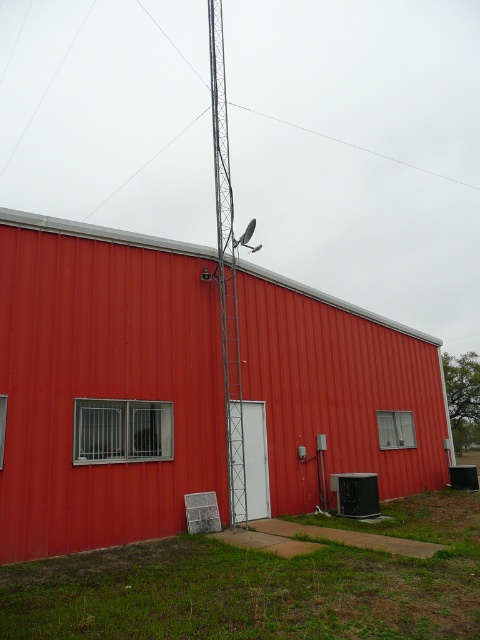
You are standing at point A, which is at coordinate point A at [7,435]. You need to reach point B, which is 24.95 feet away from you. The path to point B is blocked by the tall metallic tower. Can you go around the tower to reach point B without getting closer than 10 feet to it?

The distance between point A at [7,435] and point B is 24.95 feet. Since the path is blocked by the tower and you need to stay at least 10 feet away from it, you can go around the tower while maintaining the required distance. However, the exact feasibility depends on the tower dimensions not provided here.

You are standing in front of the red corrugated metal building with the tall metallic tower in front of it. You notice two points marked on the tower. Which of the two points, point (128, 250) or point (231, 419), is closer to your current position?

Point (128, 250) is closer to the camera than point (231, 419), so the point marked (128, 250) is closer to your current position.

You are a delivery driver who needs to back up your truck to the door of the metallic red barn at center. However, there is a metallic silver antenna at center in the way. Based on the scene, can you safely back up without hitting the antenna?

The metallic red barn at center is in front of the metallic silver antenna at center, meaning the antenna is behind the barn. Since the truck needs to back up to the barn door, the antenna is not in the direct path and should not be hit during the maneuver.